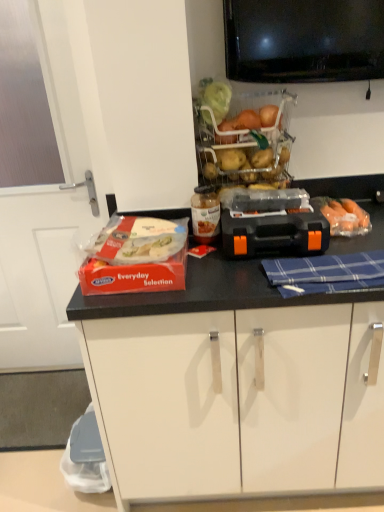
Question: Can you confirm if translucent plastic food at center left, marked as the 1th food in a left-to-right arrangement, is bigger than blue plaid cloth at center?

Choices:
 (A) no
 (B) yes

Answer: (B)

Question: From a real-world perspective, is translucent plastic food at center left, marked as the 1th food in a left-to-right arrangement, on top of blue plaid cloth at center?

Choices:
 (A) yes
 (B) no

Answer: (A)

Question: Is blue plaid cloth at center surrounded by translucent plastic food at center left, which appears as the 2th food when viewed from the right?

Choices:
 (A) yes
 (B) no

Answer: (B)

Question: Can you confirm if translucent plastic food at center left, marked as the 1th food in a left-to-right arrangement, is taller than blue plaid cloth at center?

Choices:
 (A) no
 (B) yes

Answer: (B)

Question: Could you tell me if translucent plastic food at center left, which appears as the 2th food when viewed from the right, is facing blue plaid cloth at center?

Choices:
 (A) yes
 (B) no

Answer: (B)

Question: From a real-world perspective, is black plastic toolbox at center located higher than translucent plastic basket at upper center?

Choices:
 (A) no
 (B) yes

Answer: (A)

Question: From a real-world perspective, is black plastic toolbox at center located beneath translucent plastic basket at upper center?

Choices:
 (A) yes
 (B) no

Answer: (A)

Question: Is black plastic toolbox at center further to the viewer compared to translucent plastic basket at upper center?

Choices:
 (A) no
 (B) yes

Answer: (A)

Question: From the image's perspective, is black plastic toolbox at center over translucent plastic basket at upper center?

Choices:
 (A) no
 (B) yes

Answer: (A)

Question: Can you confirm if black plastic toolbox at center is thinner than translucent plastic basket at upper center?

Choices:
 (A) yes
 (B) no

Answer: (B)

Question: Is black plastic toolbox at center facing towards translucent plastic basket at upper center?

Choices:
 (A) no
 (B) yes

Answer: (A)

Question: Is black plastic toolbox at center at the back of translucent plastic basket at upper center?

Choices:
 (A) no
 (B) yes

Answer: (A)